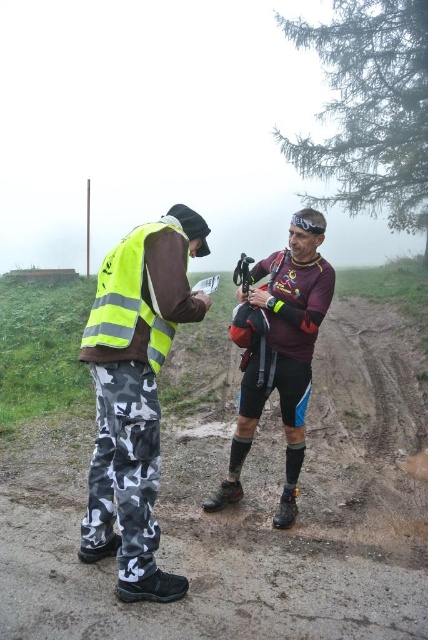
You are a hiker planning to join the group in the image. You notice the high visibility fabric vest at left and the camouflage pants at lower left. Which clothing item is covering the other?

The high visibility fabric vest at left is positioned over camouflage pants at lower left, meaning the vest is covering the pants.